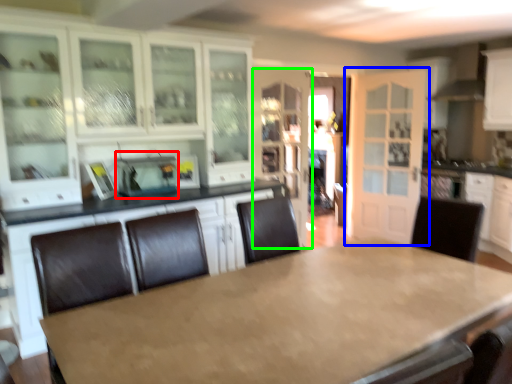
Question: Which object is positioned closest to appliance (highlighted by a red box)? Select from door (highlighted by a blue box) and cabinetry (highlighted by a green box).

Choices:
 (A) door
 (B) cabinetry

Answer: (B)